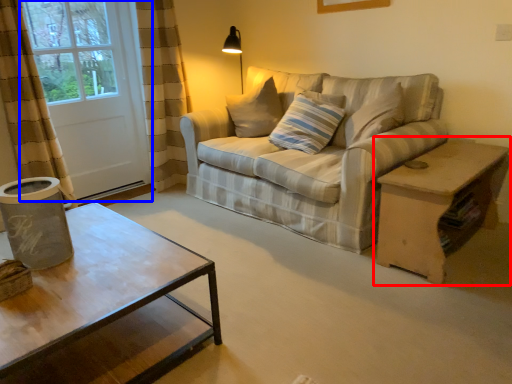
Question: Which point is closer to the camera, table (highlighted by a red box) or screen door (highlighted by a blue box)?

Choices:
 (A) table
 (B) screen door

Answer: (A)